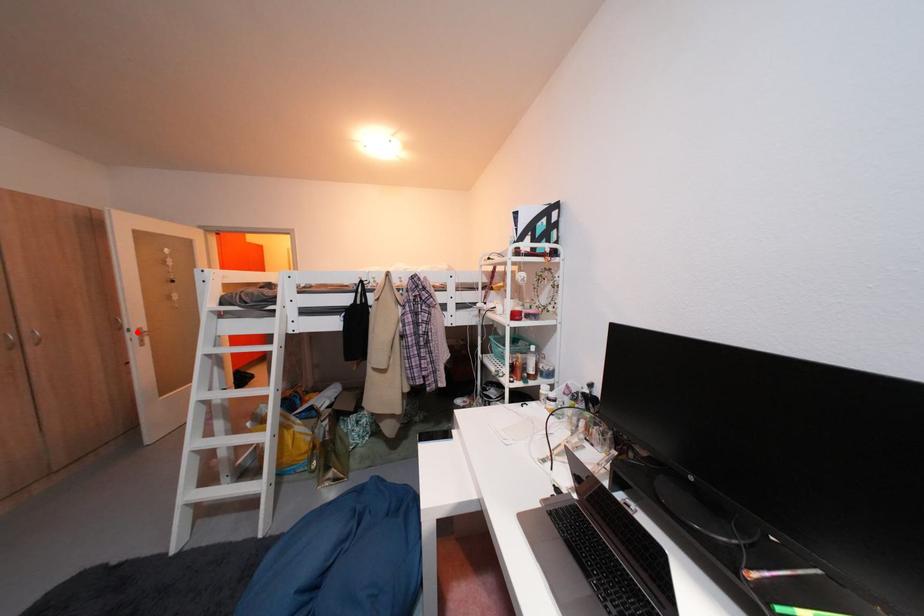
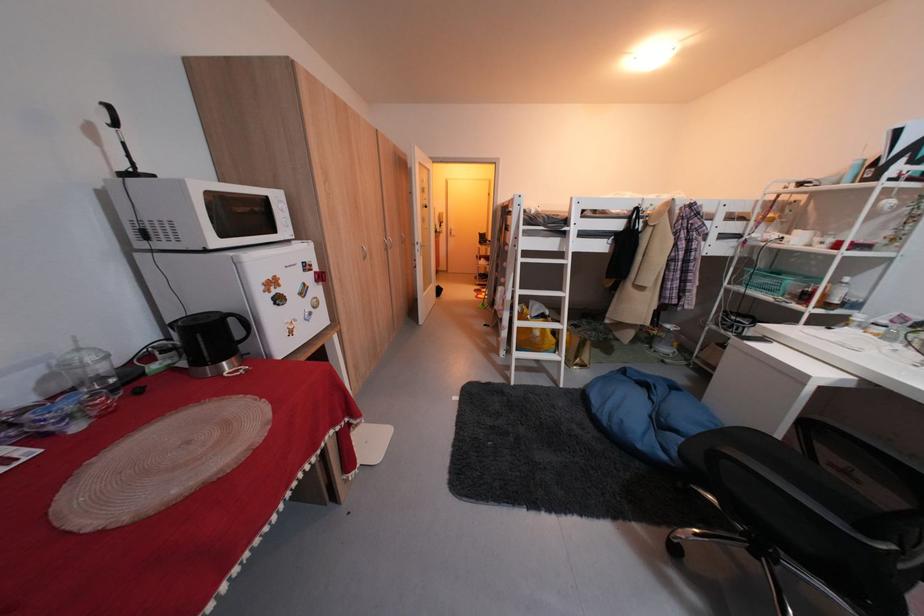
The point at the highlighted location is marked in the first image. Where is the corresponding point in the second image?

(428, 245)